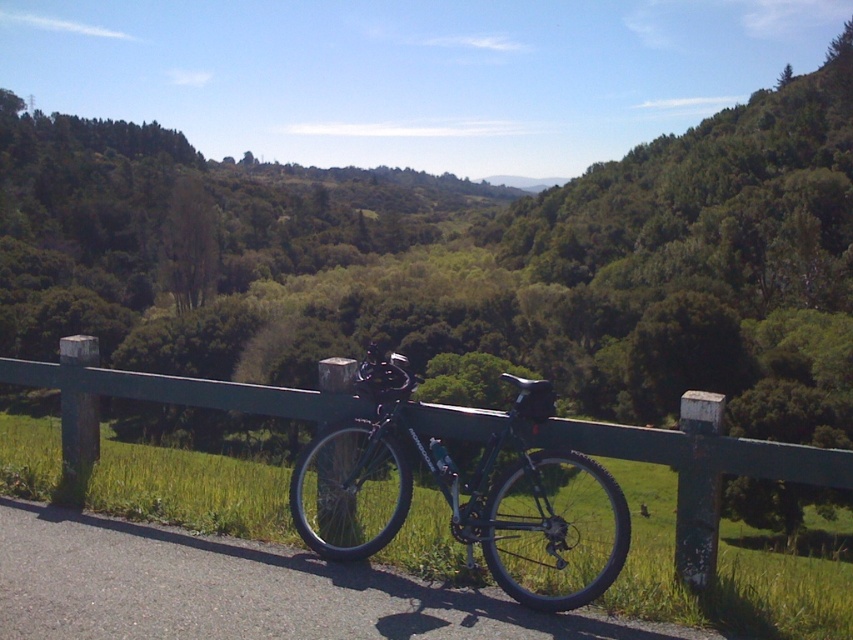
Question: Can you confirm if green metal fence at center is smaller than matte black bicycle at center?

Choices:
 (A) yes
 (B) no

Answer: (A)

Question: Which object appears closest to the camera in this image?

Choices:
 (A) green metal fence at center
 (B) matte black bicycle at center

Answer: (A)

Question: Does green metal fence at center have a larger size compared to matte black bicycle at center?

Choices:
 (A) no
 (B) yes

Answer: (A)

Question: Which point appears closest to the camera in this image?

Choices:
 (A) (396, 500)
 (B) (93, 442)

Answer: (A)

Question: Does green metal fence at center appear on the left side of matte black bicycle at center?

Choices:
 (A) yes
 (B) no

Answer: (A)